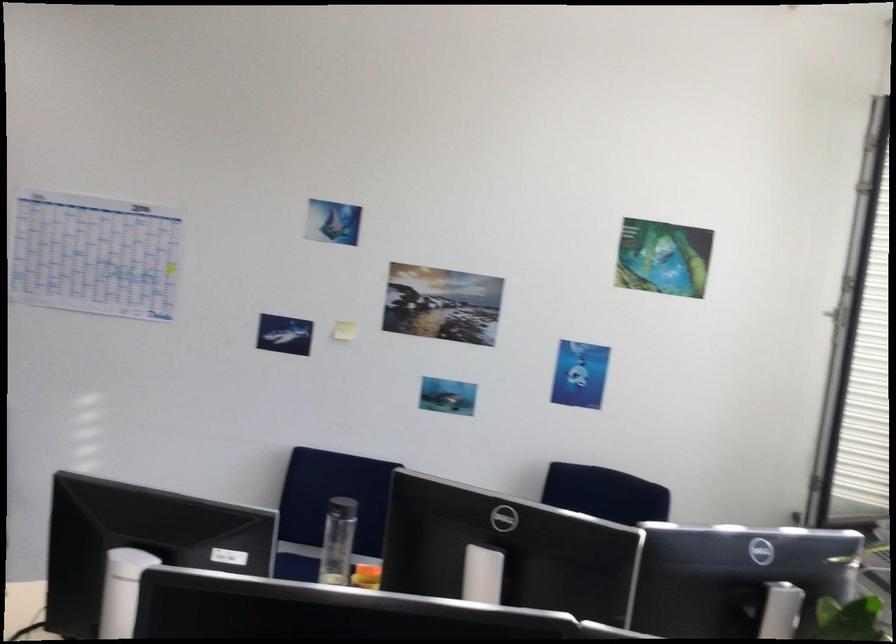
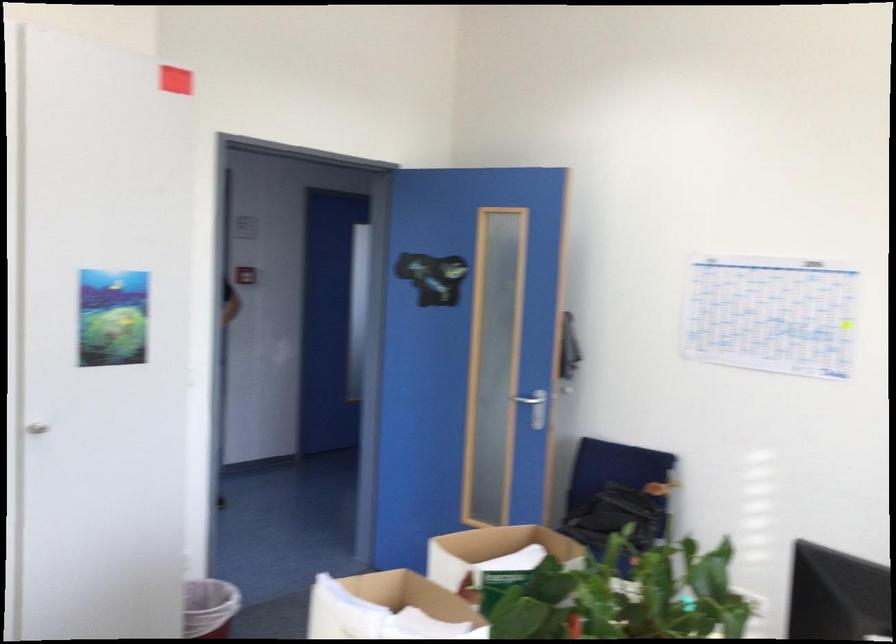
Question: The camera is either moving clockwise (left) or counter-clockwise (right) around the object. The first image is from the beginning of the video and the second image is from the end. Is the camera moving left or right when shooting the video?

Choices:
 (A) Left
 (B) Right

Answer: (B)